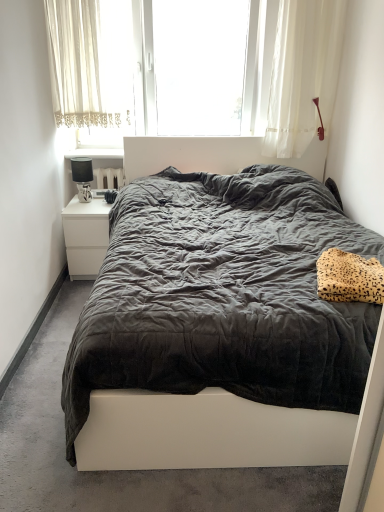
Measure the distance between matte black lamp at left and camera.

matte black lamp at left is 3.17 meters from camera.

Image resolution: width=384 pixels, height=512 pixels. In order to click on white glossy nightstand at left in this screenshot , I will do `click(86, 236)`.

Locate an element on the screen. white sheer curtain at upper center is located at coordinates (293, 71).

From a real-world perspective, is white glossy nightstand at left physically above leopard print fabric pillow at right?

No, from a real-world perspective, white glossy nightstand at left is not over leopard print fabric pillow at right

Is white glossy nightstand at left oriented towards leopard print fabric pillow at right?

No.

From the image's perspective, would you say white glossy nightstand at left is shown under leopard print fabric pillow at right?

Actually, white glossy nightstand at left appears above leopard print fabric pillow at right in the image.

Which object is wider, white glossy nightstand at left or leopard print fabric pillow at right?

white glossy nightstand at left.

Looking at their sizes, would you say white glossy nightstand at left is wider or thinner than white sheer curtain at upper left?

white glossy nightstand at left is wider than white sheer curtain at upper left.

The height and width of the screenshot is (512, 384). Identify the location of nightstand behind the white sheer curtain at upper left. (86, 236).

Does white glossy nightstand at left appear on the left side of white sheer curtain at upper left?

Correct, you'll find white glossy nightstand at left to the left of white sheer curtain at upper left.

Between point (85, 255) and point (117, 91), which one is positioned in front?

Point (85, 255)

Consider the image. Is white glossy nightstand at upper left located within white glossy nightstand at left?

No, white glossy nightstand at upper left is not a part of white glossy nightstand at left.

Consider the image. Is white glossy nightstand at left facing towards white glossy nightstand at upper left?

No.

Does white glossy nightstand at left have a larger size compared to white glossy nightstand at upper left?

Yes, white glossy nightstand at left is bigger than white glossy nightstand at upper left.

From a real-world perspective, is white glossy nightstand at left above or below white glossy nightstand at upper left?

From a real-world perspective, white glossy nightstand at left is physically below white glossy nightstand at upper left.

Between leopard print fabric pillow at right and white glossy nightstand at upper left, which one has smaller size?

white glossy nightstand at upper left is smaller.

Can you confirm if leopard print fabric pillow at right is taller than white glossy nightstand at upper left?

Yes, leopard print fabric pillow at right is taller than white glossy nightstand at upper left.

Is leopard print fabric pillow at right spatially inside white glossy nightstand at upper left, or outside of it?

leopard print fabric pillow at right exists outside the volume of white glossy nightstand at upper left.

From the image's perspective, is leopard print fabric pillow at right located beneath white glossy nightstand at upper left?

Correct, leopard print fabric pillow at right appears lower than white glossy nightstand at upper left in the image.

How far apart are dark grey fabric bed at center and white sheer curtain at upper center?

A distance of 2.47 meters exists between dark grey fabric bed at center and white sheer curtain at upper center.

In terms of size, does dark grey fabric bed at center appear bigger or smaller than white sheer curtain at upper center?

Clearly, dark grey fabric bed at center is larger in size than white sheer curtain at upper center.

In the scene shown: Considering the relative positions of dark grey fabric bed at center and white sheer curtain at upper center in the image provided, is dark grey fabric bed at center to the left of white sheer curtain at upper center from the viewer's perspective?

Incorrect, dark grey fabric bed at center is not on the left side of white sheer curtain at upper center.

From the picture: Is dark grey fabric bed at center positioned far away from white sheer curtain at upper center?

Yes, dark grey fabric bed at center and white sheer curtain at upper center are quite far apart.

From the image's perspective, which one is positioned lower, white sheer curtain at upper center or white glossy nightstand at upper left?

white glossy nightstand at upper left, from the image's perspective.

Choose the correct answer: Is white sheer curtain at upper center inside white glossy nightstand at upper left or outside it?

white sheer curtain at upper center exists outside the volume of white glossy nightstand at upper left.

In the scene shown: Between white sheer curtain at upper center and white glossy nightstand at upper left, which one appears on the right side from the viewer's perspective?

white sheer curtain at upper center.

Visually, is white sheer curtain at upper center positioned to the left or to the right of white sheer curtain at upper left?

white sheer curtain at upper center is to the right of white sheer curtain at upper left.

Is white sheer curtain at upper center situated inside white sheer curtain at upper left or outside?

white sheer curtain at upper center is not enclosed by white sheer curtain at upper left.

At what (x,y) coordinates should I click in order to perform the action: click on window that appears below the white sheer curtain at upper left (from a real-world perspective). Please return your answer as a coordinate pair (x, y). The width and height of the screenshot is (384, 512). Looking at the image, I should click on (293, 71).

Considering the relative sizes of white sheer curtain at upper center and white sheer curtain at upper left in the image provided, is white sheer curtain at upper center wider than white sheer curtain at upper left?

Indeed, white sheer curtain at upper center has a greater width compared to white sheer curtain at upper left.

Locate an element on the screen. pillow that is on the right side of white glossy nightstand at left is located at coordinates (349, 278).

Find the location of a particular element. nightstand behind the white sheer curtain at upper left is located at coordinates click(86, 236).

Looking at the image, which one is located further to white sheer curtain at upper center, dark grey fabric bed at center or white glossy nightstand at left?

dark grey fabric bed at center lies further to white sheer curtain at upper center than the other object.

Looking at the image, which one is located further to leopard print fabric pillow at right, white sheer curtain at upper left or matte black lamp at left?

white sheer curtain at upper left is further to leopard print fabric pillow at right.

Considering their positions, is white glossy nightstand at upper left positioned closer to matte black lamp at left than dark grey fabric bed at center?

Based on the image, white glossy nightstand at upper left appears to be nearer to matte black lamp at left.

Which object lies nearer to the anchor point matte black lamp at left, white sheer curtain at upper center or leopard print fabric pillow at right?

Based on the image, white sheer curtain at upper center appears to be nearer to matte black lamp at left.

Considering their positions, is white glossy nightstand at upper left positioned closer to dark grey fabric bed at center than white sheer curtain at upper left?

Among the two, white glossy nightstand at upper left is located nearer to dark grey fabric bed at center.

From the image, which object appears to be nearer to matte black lamp at left, white glossy nightstand at upper left or white sheer curtain at upper left?

The object closer to matte black lamp at left is white glossy nightstand at upper left.

Considering their positions, is white glossy nightstand at left positioned further to white glossy nightstand at upper left than white sheer curtain at upper left?

The object further to white glossy nightstand at upper left is white glossy nightstand at left.

Based on their spatial positions, is white glossy nightstand at left or white sheer curtain at upper center further from white sheer curtain at upper left?

white glossy nightstand at left.

The height and width of the screenshot is (512, 384). I want to click on window sill between white sheer curtain at upper left and white glossy nightstand at left in the up-down direction, so click(96, 153).

The width and height of the screenshot is (384, 512). Find the location of `lamp between white sheer curtain at upper left and white glossy nightstand at left from top to bottom`. lamp between white sheer curtain at upper left and white glossy nightstand at left from top to bottom is located at coordinates (82, 177).

Locate an element on the screen. curtain between white sheer curtain at upper center and matte black lamp at left vertically is located at coordinates (76, 64).

I want to click on lamp between white sheer curtain at upper center and white glossy nightstand at left vertically, so click(82, 177).